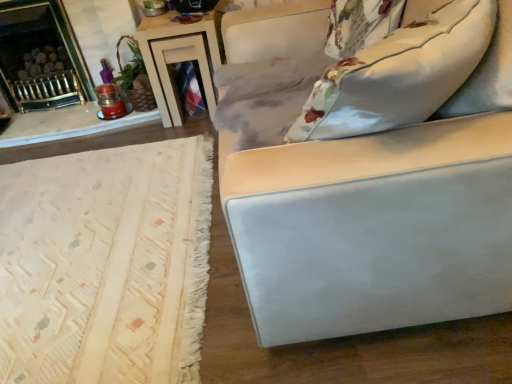
Question: Should I look upward or downward to see wooden table at upper center?

Choices:
 (A) down
 (B) up

Answer: (B)

Question: Considering the relative sizes of floral fabric pillow at upper right and brushed metal fireplace at upper left in the image provided, is floral fabric pillow at upper right taller than brushed metal fireplace at upper left?

Choices:
 (A) yes
 (B) no

Answer: (B)

Question: From the image's perspective, does floral fabric pillow at upper right appear lower than brushed metal fireplace at upper left?

Choices:
 (A) yes
 (B) no

Answer: (A)

Question: Is floral fabric pillow at upper right aimed at brushed metal fireplace at upper left?

Choices:
 (A) yes
 (B) no

Answer: (B)

Question: Is floral fabric pillow at upper right thinner than brushed metal fireplace at upper left?

Choices:
 (A) yes
 (B) no

Answer: (A)

Question: Is floral fabric pillow at upper right positioned in front of brushed metal fireplace at upper left?

Choices:
 (A) yes
 (B) no

Answer: (A)

Question: Does floral fabric pillow at upper right come behind brushed metal fireplace at upper left?

Choices:
 (A) no
 (B) yes

Answer: (A)

Question: Can you confirm if brushed metal fireplace at upper left is positioned to the right of wooden table at upper center?

Choices:
 (A) no
 (B) yes

Answer: (A)

Question: From the image's perspective, is brushed metal fireplace at upper left under wooden table at upper center?

Choices:
 (A) yes
 (B) no

Answer: (B)

Question: Does brushed metal fireplace at upper left have a larger size compared to wooden table at upper center?

Choices:
 (A) yes
 (B) no

Answer: (A)

Question: Is brushed metal fireplace at upper left thinner than wooden table at upper center?

Choices:
 (A) yes
 (B) no

Answer: (A)

Question: Would you say wooden table at upper center is part of brushed metal fireplace at upper left's contents?

Choices:
 (A) yes
 (B) no

Answer: (B)

Question: Is brushed metal fireplace at upper left not inside wooden table at upper center?

Choices:
 (A) no
 (B) yes

Answer: (B)

Question: Can you confirm if brushed metal fireplace at upper left is positioned to the left of floral fabric pillow at upper right?

Choices:
 (A) yes
 (B) no

Answer: (A)